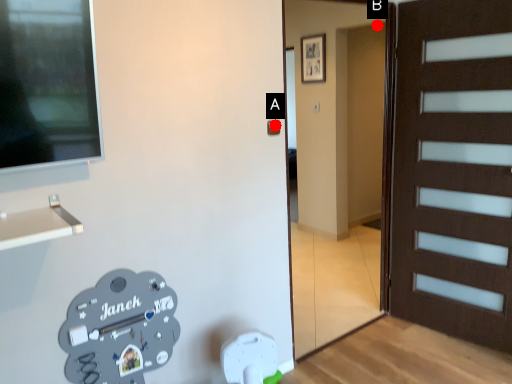
Question: Two points are circled on the image, labeled by A and B beside each circle. Which point is farther to the camera?

Choices:
 (A) A is further
 (B) B is further

Answer: (B)